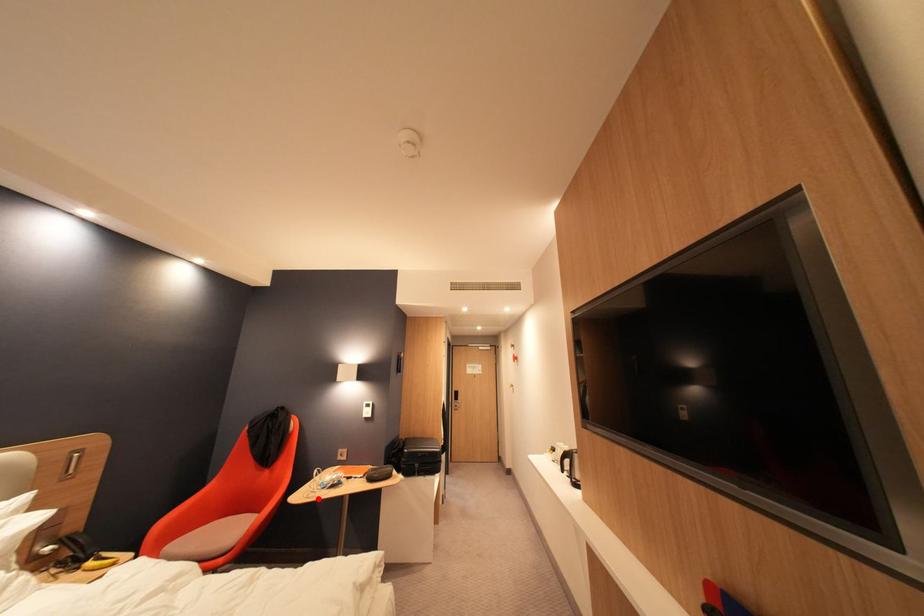
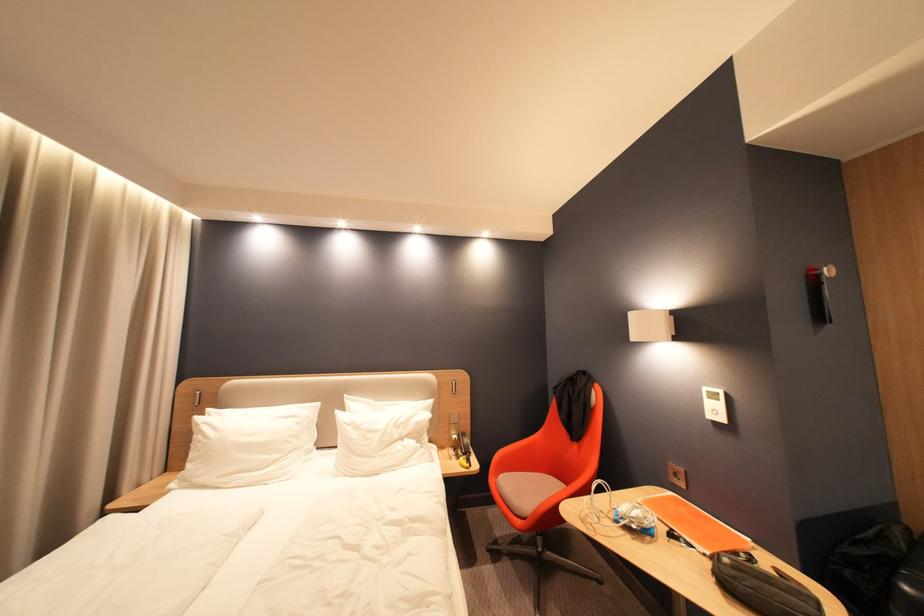
Find the pixel in the second image that matches the highlighted location in the first image.

(592, 523)